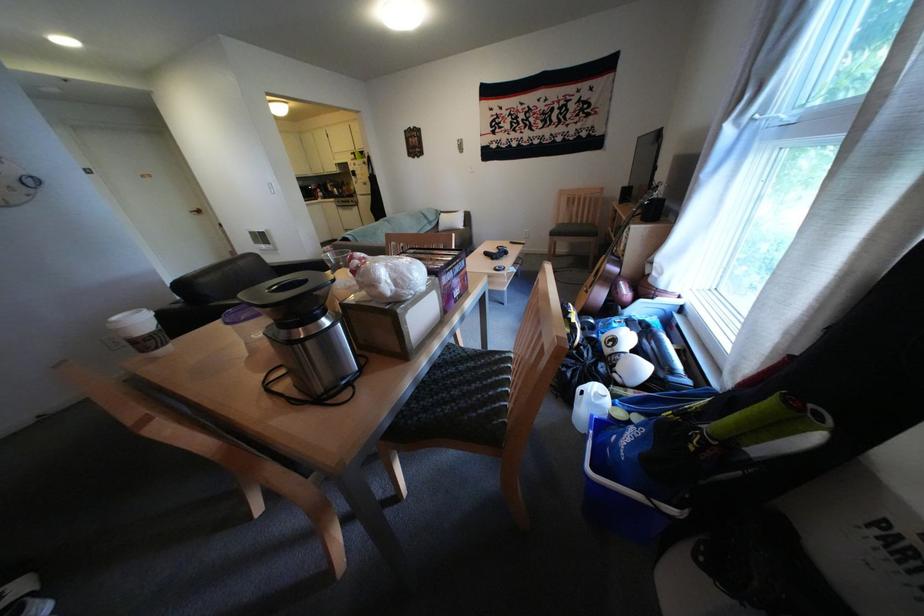
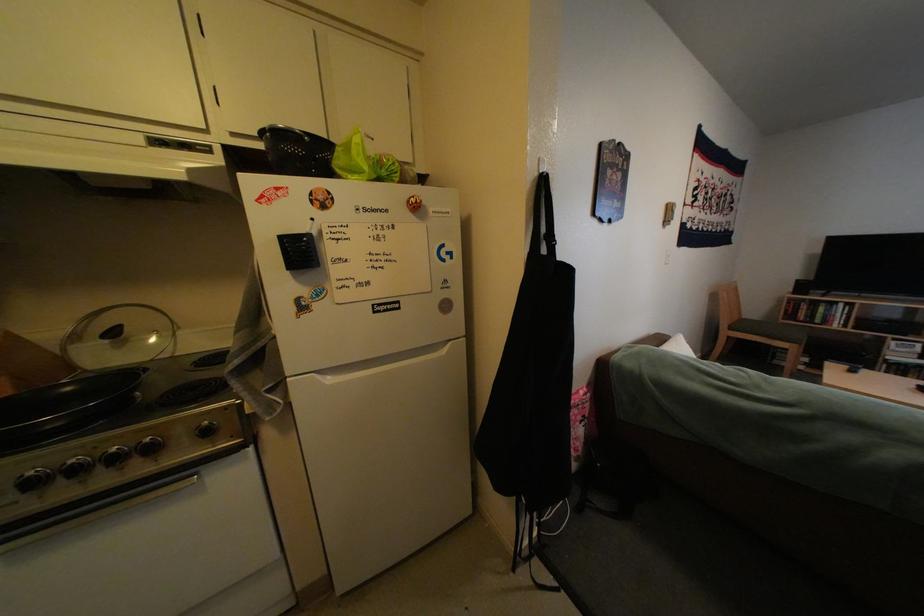
In the second image, find the point that corresponds to the point at 640,196 in the first image.

(816, 288)